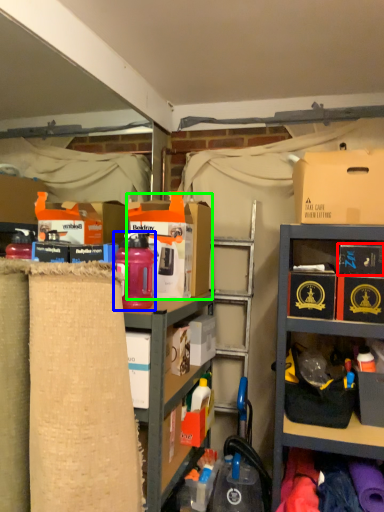
Question: Which object is the closest to the storage box (highlighted by a red box)? Choose among these: bottle (highlighted by a blue box) or storage box (highlighted by a green box).

Choices:
 (A) bottle
 (B) storage box

Answer: (B)